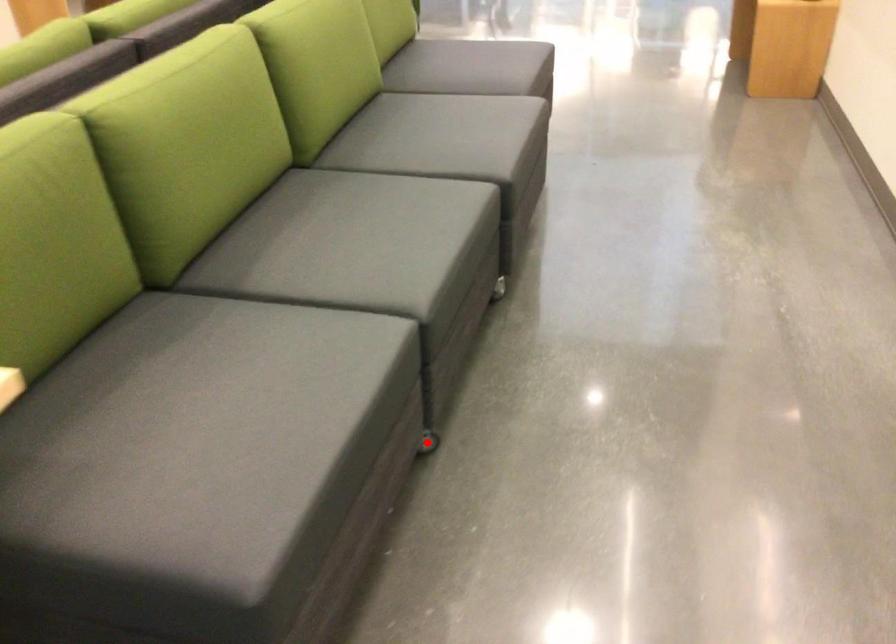
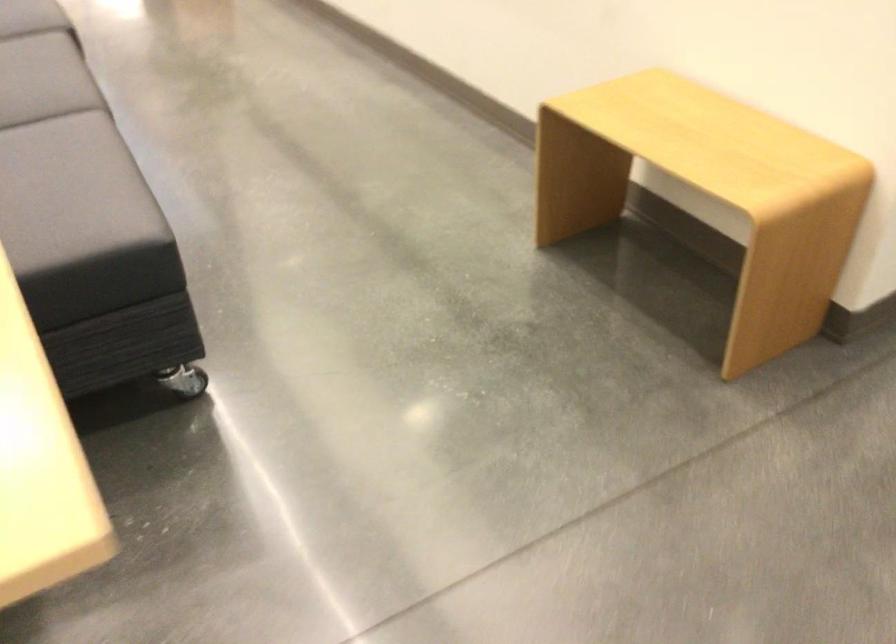
Question: I am providing you with two images of the same scene from different viewpoints. A red point is marked on the first image. Is the red point's position out of view in image 2?

Choices:
 (A) Yes
 (B) No

Answer: (A)